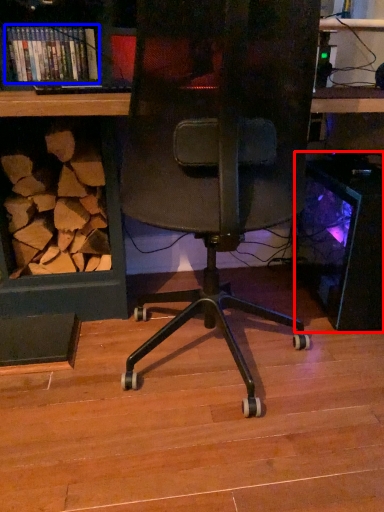
Question: Which object is closer to the camera taking this photo, desktop computer (highlighted by a red box) or book (highlighted by a blue box)?

Choices:
 (A) desktop computer
 (B) book

Answer: (A)